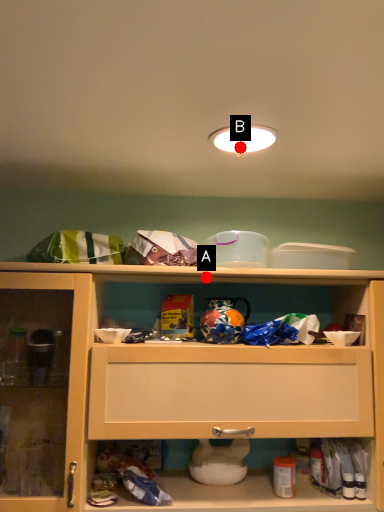
Question: Two points are circled on the image, labeled by A and B beside each circle. Which point appears farthest from the camera in this image?

Choices:
 (A) A is further
 (B) B is further

Answer: (A)